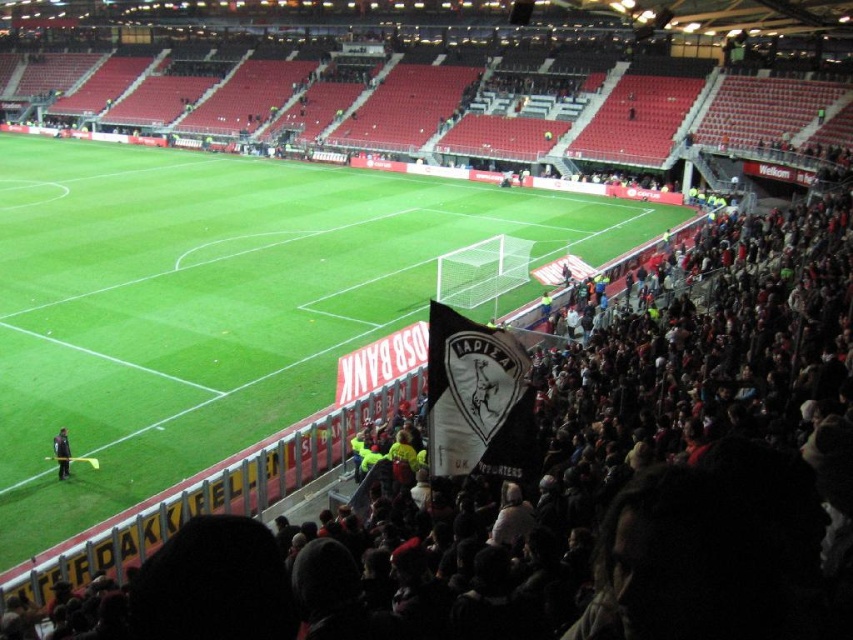
Does green grass at center have a larger size compared to dark gray uniform at lower left?

Indeed, green grass at center has a larger size compared to dark gray uniform at lower left.

Does green grass at center appear on the right side of dark gray uniform at lower left?

Correct, you'll find green grass at center to the right of dark gray uniform at lower left.

This screenshot has height=640, width=853. Find the location of `green grass at center`. green grass at center is located at coordinates (215, 301).